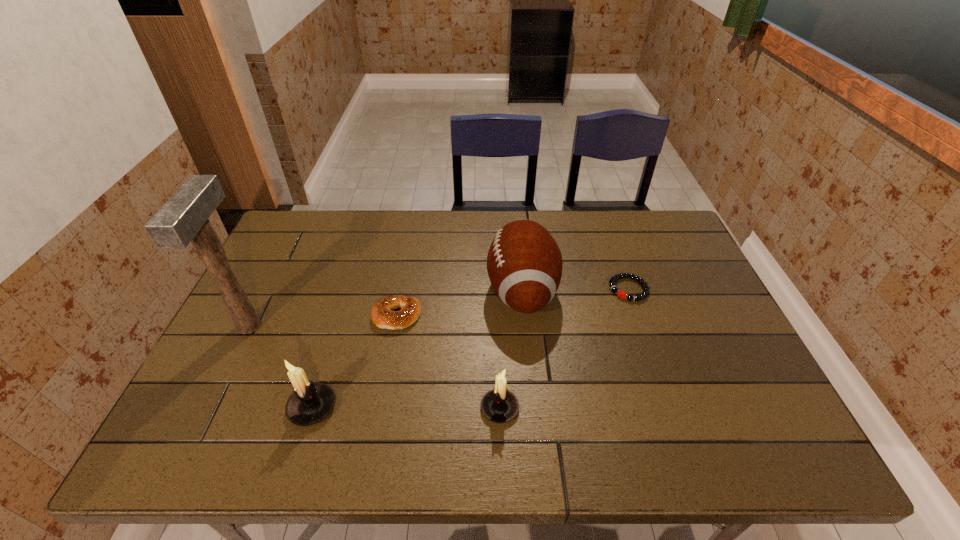
Where is `the taller candle holder`? The width and height of the screenshot is (960, 540). the taller candle holder is located at coordinates (310, 403).

This screenshot has width=960, height=540. Find the location of `the fifth object from right to left`. the fifth object from right to left is located at coordinates (310, 403).

Locate an element on the screen. the right candle holder is located at coordinates (499, 405).

Locate an element on the screen. The width and height of the screenshot is (960, 540). the shorter candle holder is located at coordinates (499, 405).

Find the location of `the rightmost object`. the rightmost object is located at coordinates (613, 279).

The width and height of the screenshot is (960, 540). Find the location of `the shortest object`. the shortest object is located at coordinates (613, 279).

This screenshot has width=960, height=540. What are the coordinates of `mallet` in the screenshot? It's located at [183, 218].

Locate an element on the screen. This screenshot has width=960, height=540. the leftmost object is located at coordinates (183, 218).

At what (x,y) coordinates should I click in order to perform the action: click on the second tallest object. Please return your answer as a coordinate pair (x, y). This screenshot has width=960, height=540. Looking at the image, I should click on (524, 263).

Locate an element on the screen. This screenshot has height=540, width=960. the fifth tallest object is located at coordinates (382, 314).